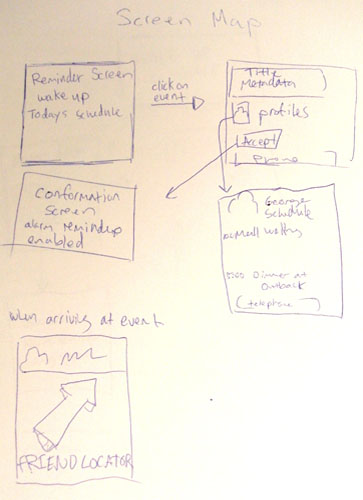
In order to click on box in this screenshot , I will do `click(112, 379)`, `click(125, 235)`, `click(303, 249)`, `click(321, 110)`, `click(93, 138)`.